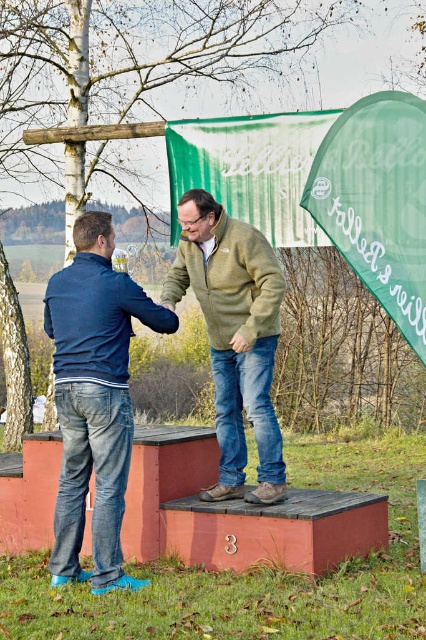
The image size is (426, 640). What do you see at coordinates (94, 397) in the screenshot?
I see `blue denim jeans at lower left` at bounding box center [94, 397].

Who is shorter, blue denim jeans at lower left or green fuzzy sweater at center?

green fuzzy sweater at center is shorter.

Between point (57, 531) and point (273, 483), which one is positioned in front?

Positioned in front is point (57, 531).

Where is `blue denim jeans at lower left`? Image resolution: width=426 pixels, height=640 pixels. blue denim jeans at lower left is located at coordinates (94, 397).